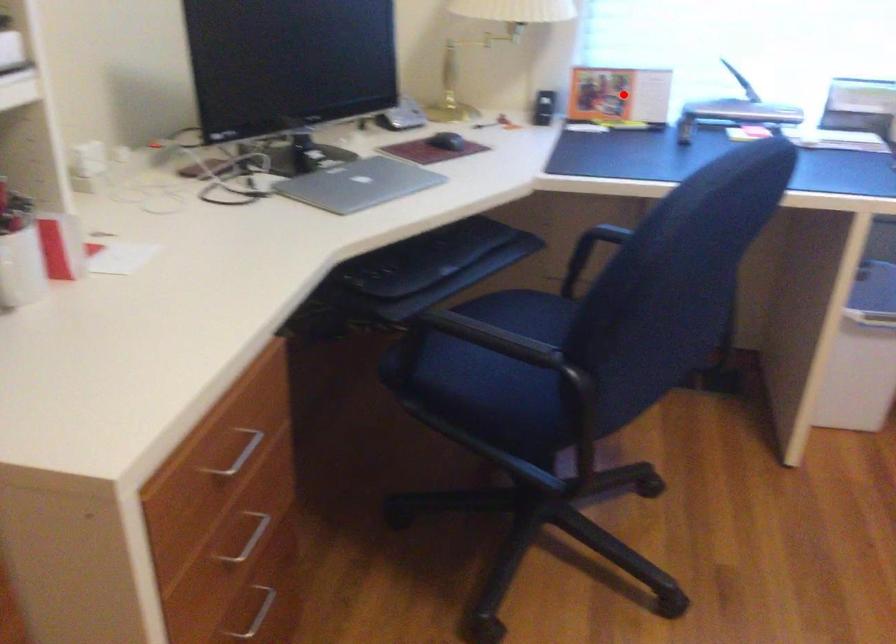
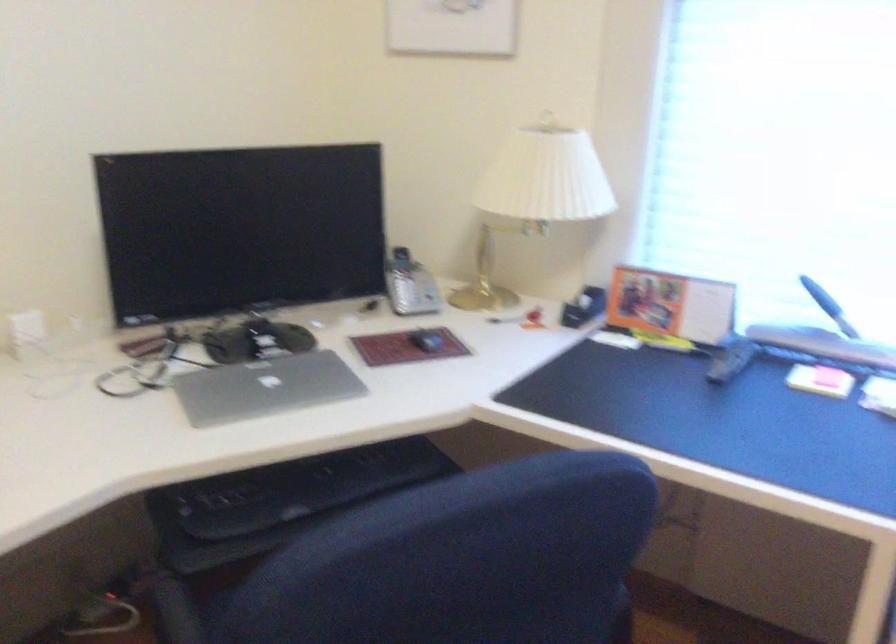
In the second image, find the point that corresponds to the highlighted location in the first image.

(670, 305)